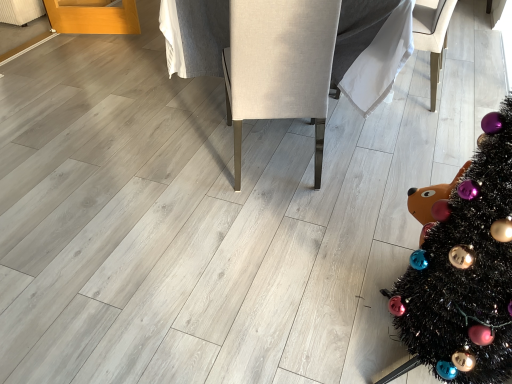
Question: Would you say beige fabric armchair at center, the 2th armchair viewed from the right, is part of black tinsel christmas tree at lower right's contents?

Choices:
 (A) no
 (B) yes

Answer: (A)

Question: Does black tinsel christmas tree at lower right have a larger size compared to beige fabric armchair at center, the 2th armchair viewed from the right?

Choices:
 (A) yes
 (B) no

Answer: (B)

Question: Considering the relative sizes of black tinsel christmas tree at lower right and beige fabric armchair at center, the 2th armchair viewed from the right, in the image provided, is black tinsel christmas tree at lower right thinner than beige fabric armchair at center, the 2th armchair viewed from the right,?

Choices:
 (A) no
 (B) yes

Answer: (B)

Question: Is black tinsel christmas tree at lower right positioned behind beige fabric armchair at center, the 2th armchair viewed from the right?

Choices:
 (A) yes
 (B) no

Answer: (B)

Question: From the image's perspective, is black tinsel christmas tree at lower right on top of beige fabric armchair at center, which is the first armchair from left to right?

Choices:
 (A) no
 (B) yes

Answer: (A)

Question: Is black tinsel christmas tree at lower right facing towards beige fabric armchair at center, the 2th armchair viewed from the right?

Choices:
 (A) yes
 (B) no

Answer: (B)

Question: Is beige fabric armchair at center, which is the first armchair from left to right, aimed at black tinsel christmas tree at lower right?

Choices:
 (A) no
 (B) yes

Answer: (A)

Question: Is beige fabric armchair at center, which is the first armchair from left to right, taller than black tinsel christmas tree at lower right?

Choices:
 (A) yes
 (B) no

Answer: (B)

Question: Is beige fabric armchair at center, which is the first armchair from left to right, positioned with its back to black tinsel christmas tree at lower right?

Choices:
 (A) yes
 (B) no

Answer: (A)

Question: Is beige fabric armchair at center, which is the first armchair from left to right, at the left side of black tinsel christmas tree at lower right?

Choices:
 (A) no
 (B) yes

Answer: (B)

Question: Is beige fabric armchair at center, which is the first armchair from left to right, closer to the viewer compared to black tinsel christmas tree at lower right?

Choices:
 (A) no
 (B) yes

Answer: (A)

Question: Would you say beige fabric armchair at center, which is the first armchair from left to right, is outside black tinsel christmas tree at lower right?

Choices:
 (A) no
 (B) yes

Answer: (B)

Question: From a real-world perspective, is white fabric armchair at center, the second armchair in the left-to-right sequence, under black tinsel christmas tree at lower right?

Choices:
 (A) no
 (B) yes

Answer: (B)